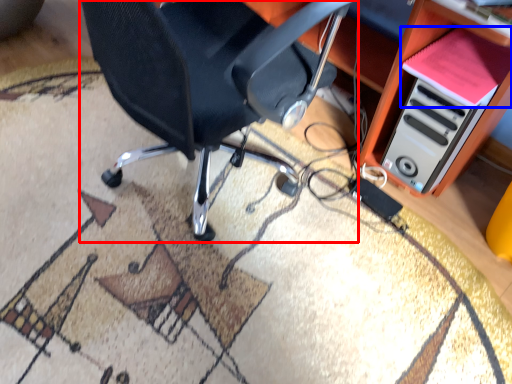
Question: Which point is further to the camera, chair (highlighted by a red box) or book (highlighted by a blue box)?

Choices:
 (A) chair
 (B) book

Answer: (B)